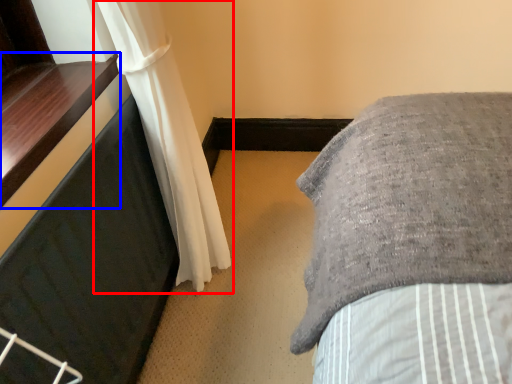
Question: Which point is further to the camera, curtain (highlighted by a red box) or window sill (highlighted by a blue box)?

Choices:
 (A) curtain
 (B) window sill

Answer: (A)